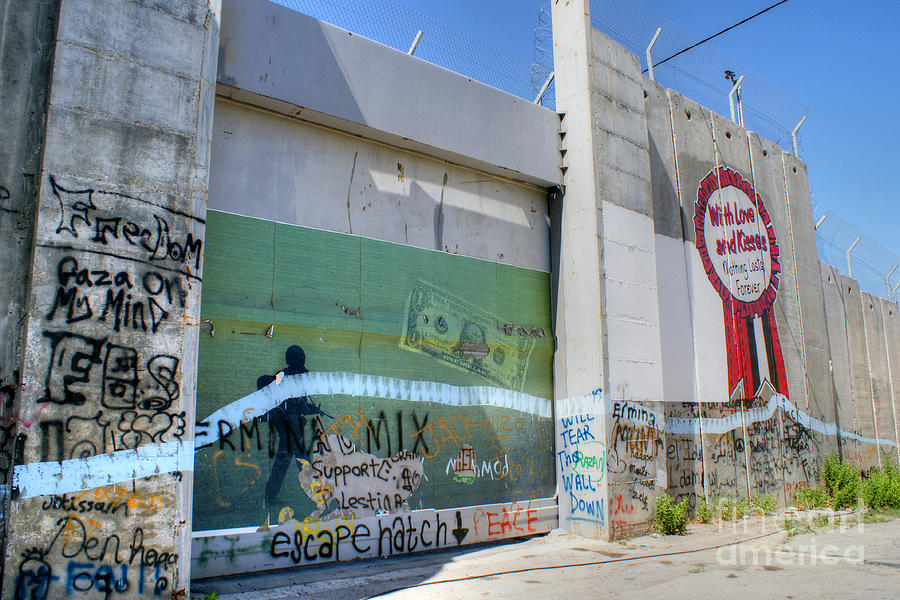
I want to click on wall, so click(718, 322).